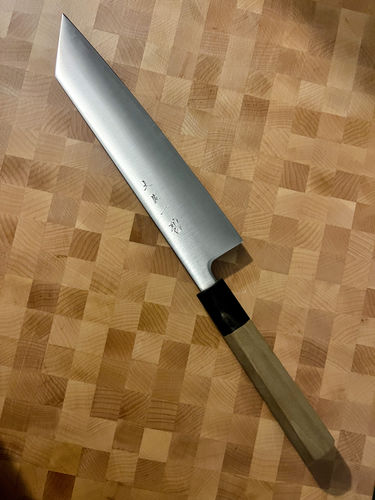
This screenshot has width=375, height=500. I want to click on table, so click(x=243, y=37).